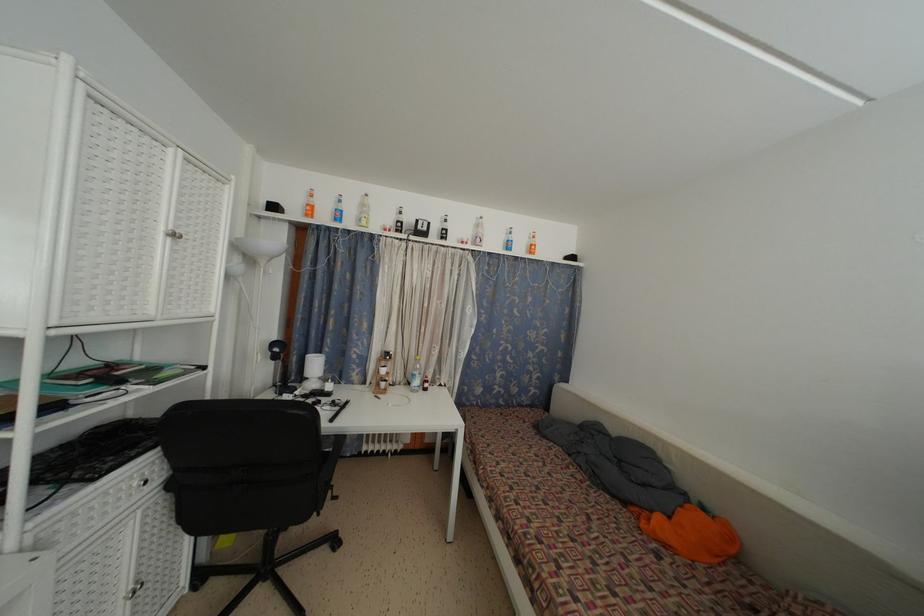
Locate an element on the screen. The height and width of the screenshot is (616, 924). yellow glass bottle is located at coordinates (362, 211).